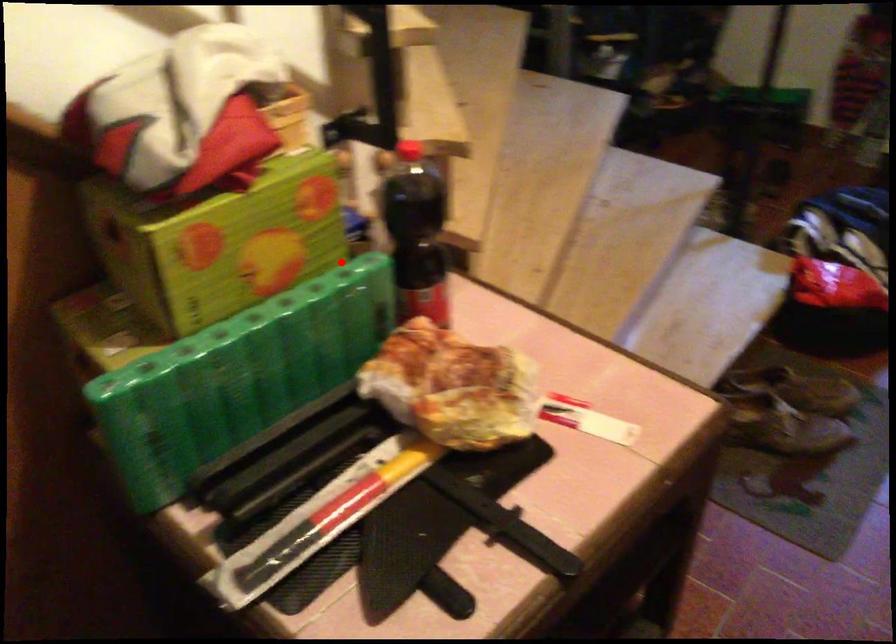
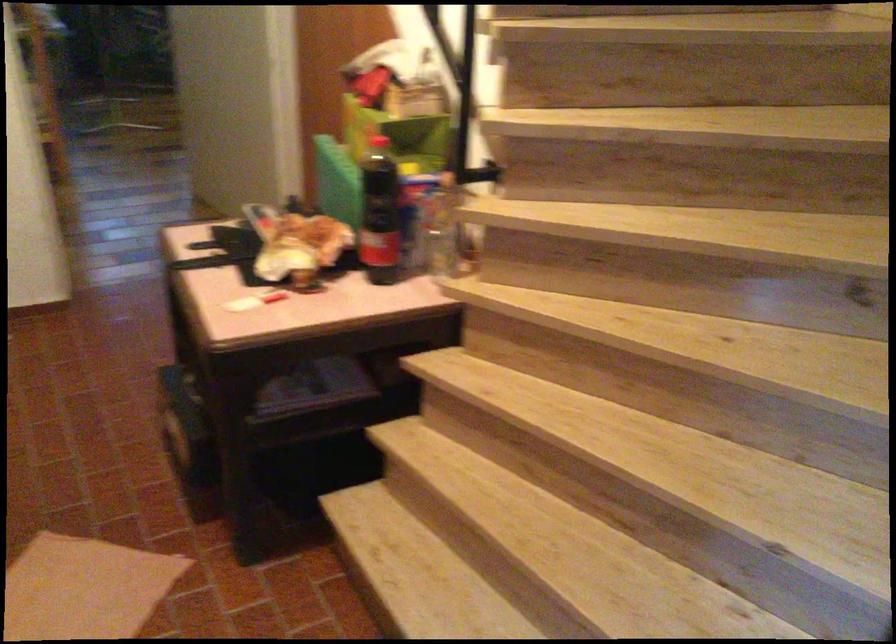
Find the pixel in the second image that matches the highlighted location in the first image.

(437, 232)